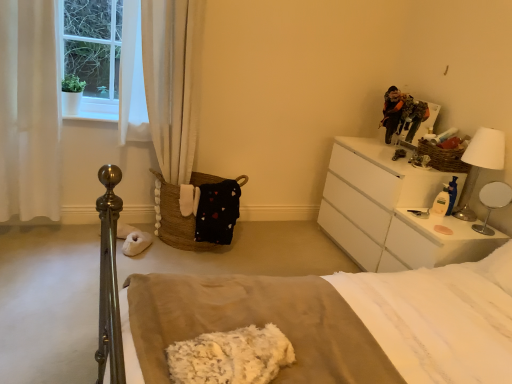
Question: Is woven brown basket at upper right, which is counted as the 1th basket, starting from the top, wider or thinner than beige cotton bed at center?

Choices:
 (A) thin
 (B) wide

Answer: (A)

Question: Do you think woven brown basket at upper right, which is counted as the 1th basket, starting from the top, is within beige cotton bed at center, or outside of it?

Choices:
 (A) inside
 (B) outside

Answer: (B)

Question: Which object is the closest to the white fabric curtain at left, which is the second curtain from left to right?

Choices:
 (A) white fluffy blanket at center
 (B) brown woven basket at lower left, the 1th basket viewed from the left
 (C) camouflage jacket at upper right
 (D) white glossy table lamp at right, the 1th table lamp ordered from the bottom
 (E) white glossy nightstand at upper right

Answer: (B)

Question: Which object is the farthest from the white glossy table lamp at right, the 1th table lamp ordered from the bottom?

Choices:
 (A) white fabric curtain at left, which is the second curtain from left to right
 (B) woven brown basket at upper right, marked as the 2th basket in a left-to-right arrangement
 (C) white glossy nightstand at upper right
 (D) beige cotton bed at center
 (E) white metallic table lamp at upper right, the 1th table lamp when ordered from top to bottom

Answer: (A)